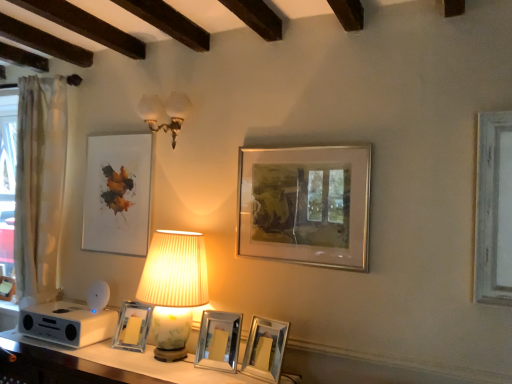
This screenshot has height=384, width=512. Describe the element at coordinates (39, 186) in the screenshot. I see `white sheer curtain at left` at that location.

Describe the element at coordinates (306, 204) in the screenshot. I see `silver/metallic picture frame at center-right, which appears as the fifth picture frame when viewed from the left` at that location.

Identify the location of metallic silver picture frame at lower center, the 4th picture frame in the left-to-right sequence. (265, 349).

What do you see at coordinates (265, 349) in the screenshot? I see `metallic silver picture frame at lower center, the 4th picture frame in the left-to-right sequence` at bounding box center [265, 349].

Where is `white glass sconce at upper center, positioned as the second lamp in bottom-to-top order`? The width and height of the screenshot is (512, 384). white glass sconce at upper center, positioned as the second lamp in bottom-to-top order is located at coordinates [x=166, y=112].

Considering the positions of objects silver/metallic picture frame at center-right, which appears as the fifth picture frame when viewed from the left, and metallic silver picture frame at lower center, the 4th picture frame in the left-to-right sequence, in the image provided, who is more to the right, silver/metallic picture frame at center-right, which appears as the fifth picture frame when viewed from the left, or metallic silver picture frame at lower center, the 4th picture frame in the left-to-right sequence,?

From the viewer's perspective, silver/metallic picture frame at center-right, which appears as the fifth picture frame when viewed from the left, appears more on the right side.

Which of these two, silver/metallic picture frame at center-right, which appears as the fifth picture frame when viewed from the left, or metallic silver picture frame at lower center, the second picture frame from the right, is thinner?

silver/metallic picture frame at center-right, which appears as the fifth picture frame when viewed from the left.

Is metallic silver picture frame at lower center, the second picture frame from the right, completely or partially inside silver/metallic picture frame at center-right, the 1th picture frame when ordered from right to left?

Actually, metallic silver picture frame at lower center, the second picture frame from the right, is outside silver/metallic picture frame at center-right, the 1th picture frame when ordered from right to left.

Considering the sizes of matte white lampshade at center, the 1th lamp ordered from the bottom, and silver metallic picture frame at center, the 3th picture frame positioned from the left, in the image, is matte white lampshade at center, the 1th lamp ordered from the bottom, taller or shorter than silver metallic picture frame at center, the 3th picture frame positioned from the left,?

In the image, matte white lampshade at center, the 1th lamp ordered from the bottom, appears to be taller than silver metallic picture frame at center, the 3th picture frame positioned from the left.

Can you tell me how much matte white lampshade at center, acting as the second lamp starting from the top, and silver metallic picture frame at center, the 3th picture frame positioned from the left, differ in facing direction?

The angle between the facing direction of matte white lampshade at center, acting as the second lamp starting from the top, and the facing direction of silver metallic picture frame at center, the 3th picture frame positioned from the left, is 5.19 degrees.

Considering the sizes of objects matte white lampshade at center, the 1th lamp ordered from the bottom, and silver metallic picture frame at center, which is the 3th picture frame from right to left, in the image provided, who is smaller, matte white lampshade at center, the 1th lamp ordered from the bottom, or silver metallic picture frame at center, which is the 3th picture frame from right to left,?

silver metallic picture frame at center, which is the 3th picture frame from right to left, is smaller.

From a real-world perspective, who is located higher, matte white lampshade at center, the 1th lamp ordered from the bottom, or silver metallic picture frame at center, the 3th picture frame positioned from the left?

In real-world perspective, matte white lampshade at center, the 1th lamp ordered from the bottom, is above.

Can you confirm if silver/metallic picture frame at center-right, which appears as the fifth picture frame when viewed from the left, is bigger than white glossy table at lower center?

No.

Is silver/metallic picture frame at center-right, which appears as the fifth picture frame when viewed from the left, aimed at white glossy table at lower center?

No, silver/metallic picture frame at center-right, which appears as the fifth picture frame when viewed from the left, is not facing towards white glossy table at lower center.

Which object is wider, silver/metallic picture frame at center-right, the 1th picture frame when ordered from right to left, or white glossy table at lower center?

Wider between the two is white glossy table at lower center.

Can you confirm if silver/metallic picture frame at center-right, the 1th picture frame when ordered from right to left, is positioned to the left of white glossy table at lower center?

In fact, silver/metallic picture frame at center-right, the 1th picture frame when ordered from right to left, is to the right of white glossy table at lower center.

Could you tell me if white sheer curtain at left is facing silver/metallic picture frame at center-right, the 1th picture frame when ordered from right to left?

No.

From a real-world perspective, is white sheer curtain at left under silver/metallic picture frame at center-right, which appears as the fifth picture frame when viewed from the left?

Yes, from a real-world perspective, white sheer curtain at left is below silver/metallic picture frame at center-right, which appears as the fifth picture frame when viewed from the left.

Which is closer to the camera, (38, 246) or (317, 192)?

The point (317, 192) is in front.

Does white sheer curtain at left have a greater height compared to silver/metallic picture frame at center-right, the 1th picture frame when ordered from right to left?

Yes, white sheer curtain at left is taller than silver/metallic picture frame at center-right, the 1th picture frame when ordered from right to left.

In the scene shown: Does white glass sconce at upper center, positioned as the second lamp in bottom-to-top order, come in front of metallic silver picture frame at lower center, the second picture frame from the right?

No, white glass sconce at upper center, positioned as the second lamp in bottom-to-top order, is behind metallic silver picture frame at lower center, the second picture frame from the right.

In terms of height, does white glass sconce at upper center, which ranks as the 1th lamp in top-to-bottom order, look taller or shorter compared to metallic silver picture frame at lower center, the second picture frame from the right?

Clearly, white glass sconce at upper center, which ranks as the 1th lamp in top-to-bottom order, is taller compared to metallic silver picture frame at lower center, the second picture frame from the right.

Locate an element on the screen. This screenshot has height=384, width=512. lamp that is the 2nd one when counting leftward from the metallic silver picture frame at lower center, the second picture frame from the right is located at coordinates (166, 112).

From a real-world perspective, who is located lower, white glass sconce at upper center, which ranks as the 1th lamp in top-to-bottom order, or metallic silver picture frame at lower center, the second picture frame from the right?

From a 3D spatial view, metallic silver picture frame at lower center, the second picture frame from the right, is below.

Which is in front, point (209, 349) or point (152, 107)?

Point (209, 349)

Is silver metallic picture frame at center, the 3th picture frame positioned from the left, bigger or smaller than white glass sconce at upper center, which ranks as the 1th lamp in top-to-bottom order?

silver metallic picture frame at center, the 3th picture frame positioned from the left, is smaller than white glass sconce at upper center, which ranks as the 1th lamp in top-to-bottom order.

Which object is closer to the camera, silver metallic picture frame at center, which is the 3th picture frame from right to left, or white glass sconce at upper center, positioned as the second lamp in bottom-to-top order?

silver metallic picture frame at center, which is the 3th picture frame from right to left, is closer to the camera.

Is silver metallic picture frame at center, the 3th picture frame positioned from the left, wider or thinner than white glass sconce at upper center, positioned as the second lamp in bottom-to-top order?

silver metallic picture frame at center, the 3th picture frame positioned from the left, is thinner than white glass sconce at upper center, positioned as the second lamp in bottom-to-top order.

From the image's perspective, who appears lower, silver metallic picture frame at center, which is the 3th picture frame from right to left, or matte white picture frame at upper left, which is counted as the first picture frame, starting from the left?

silver metallic picture frame at center, which is the 3th picture frame from right to left, is shown below in the image.

The image size is (512, 384). I want to click on picture frame that is the 3rd object located above the silver metallic picture frame at center, which is the 3th picture frame from right to left (from the image's perspective), so click(118, 194).

What's the angular difference between silver metallic picture frame at center, which is the 3th picture frame from right to left, and matte white picture frame at upper left, which is counted as the fifth picture frame, starting from the right,'s facing directions?

The angular difference between silver metallic picture frame at center, which is the 3th picture frame from right to left, and matte white picture frame at upper left, which is counted as the fifth picture frame, starting from the right, is 6.68 degrees.

From the image's perspective, count 1st picture frames downward from the silver/metallic picture frame at center-right, which appears as the fifth picture frame when viewed from the left, and point to it. Please provide its 2D coordinates.

[(265, 349)]

The width and height of the screenshot is (512, 384). I want to click on the 1st picture frame behind the matte white lampshade at center, the 1th lamp ordered from the bottom, so click(219, 341).

Which object lies nearer to the anchor point white sheer curtain at left, clear glass photo frame at center, the second picture frame from the left, or matte white lampshade at center, acting as the second lamp starting from the top?

Based on the image, clear glass photo frame at center, the second picture frame from the left, appears to be nearer to white sheer curtain at left.

Based on their spatial positions, is white sheer curtain at left or matte white lampshade at center, acting as the second lamp starting from the top, closer to silver metallic picture frame at center, the 3th picture frame positioned from the left?

Among the two, matte white lampshade at center, acting as the second lamp starting from the top, is located nearer to silver metallic picture frame at center, the 3th picture frame positioned from the left.

From the image, which object appears to be nearer to matte white lampshade at center, acting as the second lamp starting from the top, white glossy table at lower center or white glass sconce at upper center, positioned as the second lamp in bottom-to-top order?

white glossy table at lower center.

Estimate the real-world distances between objects in this image. Which object is further from metallic silver picture frame at lower center, the 4th picture frame in the left-to-right sequence, silver/metallic picture frame at center-right, which appears as the fifth picture frame when viewed from the left, or clear glass photo frame at center, positioned as the 4th picture frame in right-to-left order?

clear glass photo frame at center, positioned as the 4th picture frame in right-to-left order, is further to metallic silver picture frame at lower center, the 4th picture frame in the left-to-right sequence.

Estimate the real-world distances between objects in this image. Which object is further from matte white picture frame at upper left, which is counted as the fifth picture frame, starting from the right, matte white lampshade at center, the 1th lamp ordered from the bottom, or silver/metallic picture frame at center-right, the 1th picture frame when ordered from right to left?

silver/metallic picture frame at center-right, the 1th picture frame when ordered from right to left, lies further to matte white picture frame at upper left, which is counted as the fifth picture frame, starting from the right, than the other object.

From the picture: Based on their spatial positions, is white glossy table at lower center or white sheer curtain at left further from silver metallic picture frame at center, the 3th picture frame positioned from the left?

white sheer curtain at left.

Looking at the image, which one is located closer to matte white picture frame at upper left, which is counted as the fifth picture frame, starting from the right, matte white lampshade at center, acting as the second lamp starting from the top, or white glossy table at lower center?

matte white lampshade at center, acting as the second lamp starting from the top.

Estimate the real-world distances between objects in this image. Which object is closer to matte white picture frame at upper left, which is counted as the fifth picture frame, starting from the right, silver/metallic picture frame at center-right, which appears as the fifth picture frame when viewed from the left, or silver metallic picture frame at center, the 3th picture frame positioned from the left?

silver metallic picture frame at center, the 3th picture frame positioned from the left, is positioned closer to the anchor matte white picture frame at upper left, which is counted as the fifth picture frame, starting from the right.

Find the location of `curtain that lies between matte white picture frame at upper left, which is counted as the fifth picture frame, starting from the right, and white glossy table at lower center from top to bottom`. curtain that lies between matte white picture frame at upper left, which is counted as the fifth picture frame, starting from the right, and white glossy table at lower center from top to bottom is located at coordinates (39, 186).

Image resolution: width=512 pixels, height=384 pixels. I want to click on lamp located between white glossy table at lower center and clear glass photo frame at center, the second picture frame from the left, in the depth direction, so click(x=174, y=288).

The width and height of the screenshot is (512, 384). I want to click on picture frame between silver/metallic picture frame at center-right, the 1th picture frame when ordered from right to left, and silver metallic picture frame at center, the 3th picture frame positioned from the left, in the vertical direction, so click(265, 349).

Find the location of `lamp between white sheer curtain at left and matte white lampshade at center, the 1th lamp ordered from the bottom`. lamp between white sheer curtain at left and matte white lampshade at center, the 1th lamp ordered from the bottom is located at coordinates (166, 112).